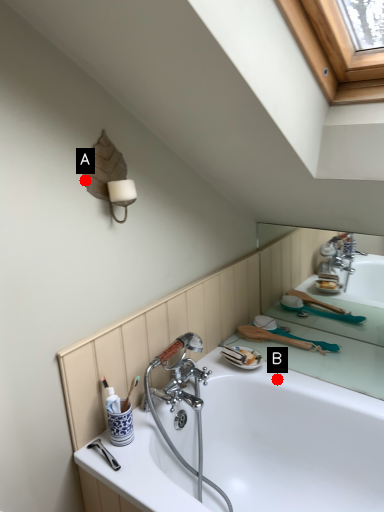
Question: Two points are circled on the image, labeled by A and B beside each circle. Which of the following is the farthest from the observer?

Choices:
 (A) A is further
 (B) B is further

Answer: (B)